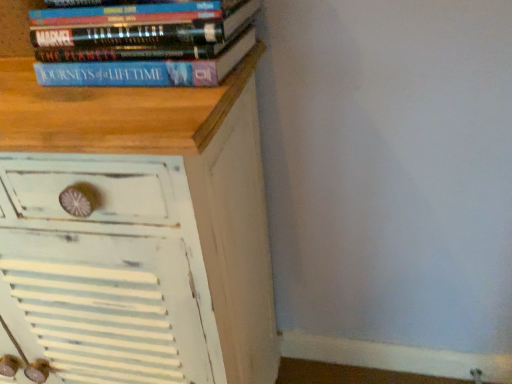
Image resolution: width=512 pixels, height=384 pixels. Find the location of `free space in front of blue matte book at upper left`. free space in front of blue matte book at upper left is located at coordinates (120, 103).